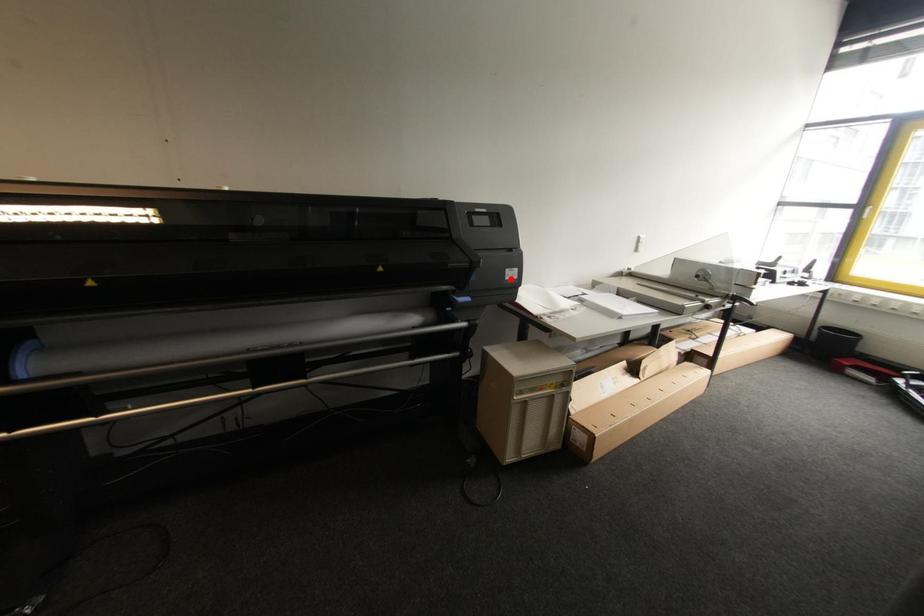
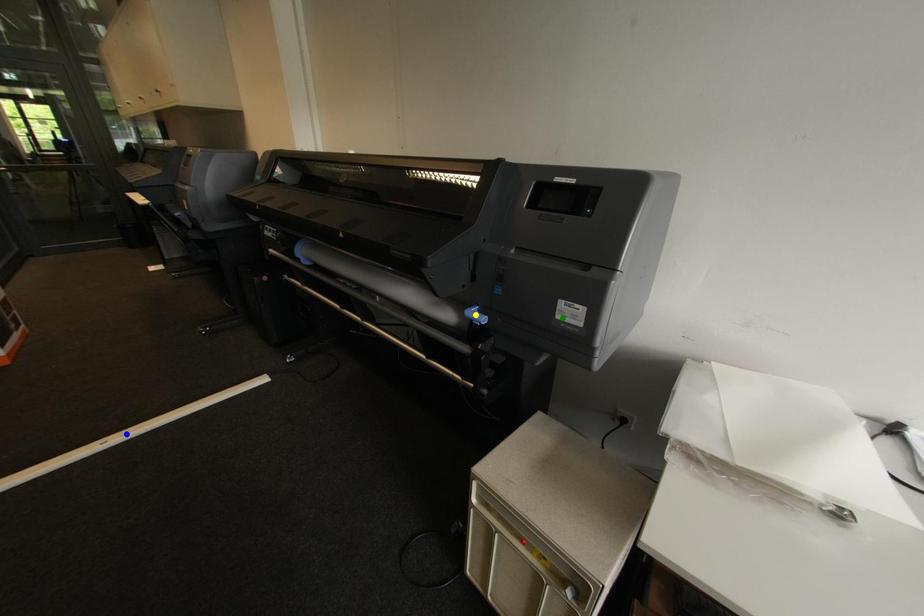
Question: I am providing you with two images of the same scene from different viewpoints. A red point is marked on the first image. You are given multiple points on the second image. Which spot in image 2 lines up with the point in image 1?

Choices:
 (A) yellow point
 (B) green point
 (C) blue point

Answer: (B)